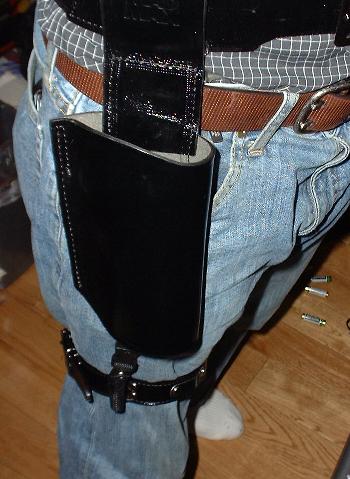
Find the location of `sock`. sock is located at coordinates (224, 418).